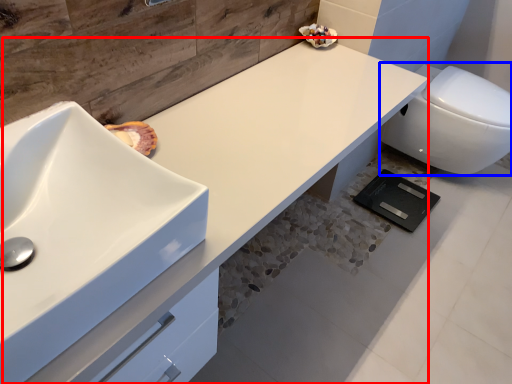
Question: Which object appears farthest to the camera in this image, counter top (highlighted by a red box) or toilet (highlighted by a blue box)?

Choices:
 (A) counter top
 (B) toilet

Answer: (B)